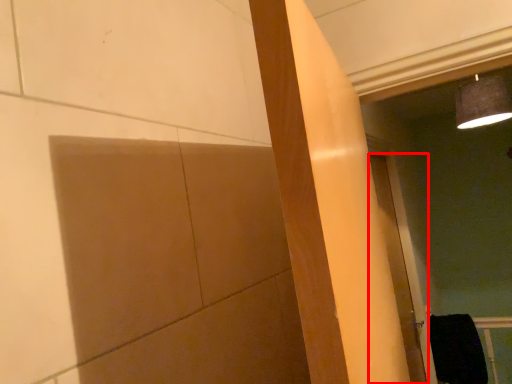
Question: Where is door (annotated by the red box) located in relation to material in the image?

Choices:
 (A) left
 (B) right

Answer: (A)